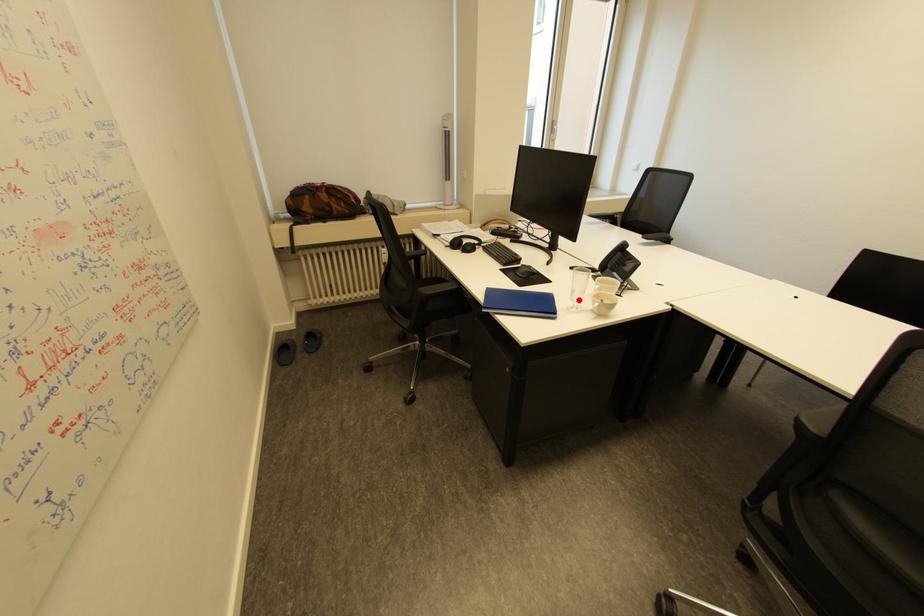
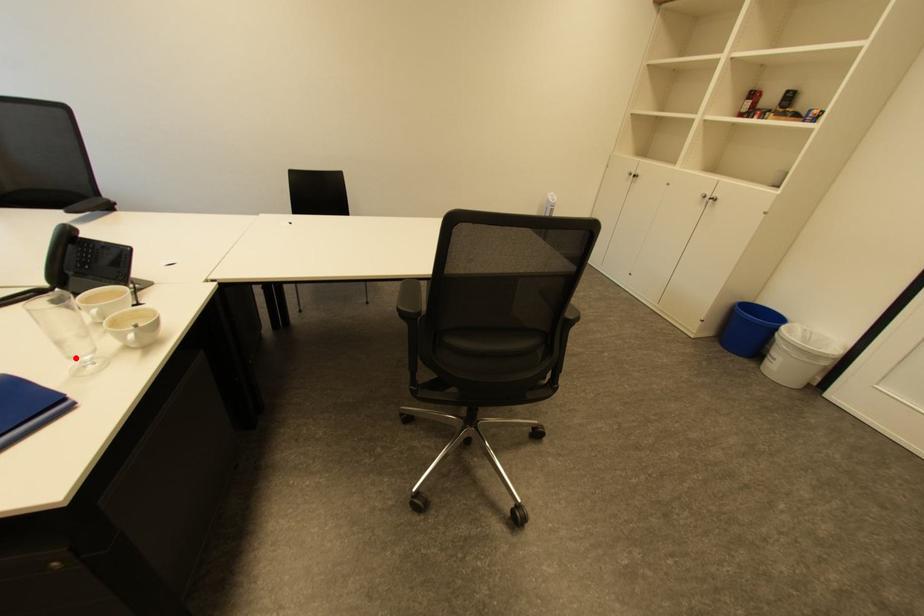
I am providing you with two images of the same scene from different viewpoints. A red point is marked on the first image and another point is marked on the second image. Are the points marked in image1 and image2 representing the same 3D position?

Yes